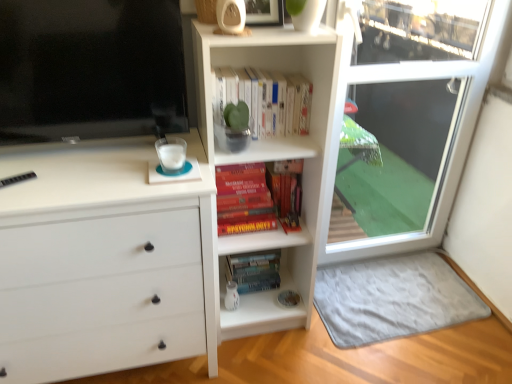
At what (x,y) coordinates should I click in order to perform the action: click on space that is in front of flat screen tv at upper left. Please return your answer as a coordinate pair (x, y). The image size is (512, 384). Looking at the image, I should click on (79, 181).